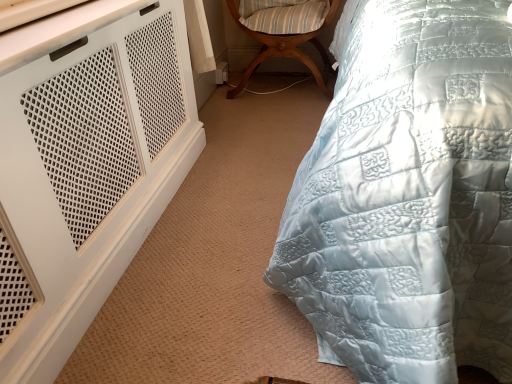
This screenshot has height=384, width=512. Describe the element at coordinates (284, 34) in the screenshot. I see `wooden striped cushioned chair at center` at that location.

In order to face wooden striped cushioned chair at center, should I rotate leftwards or rightwards?

You should look right and rotate roughly 4.130 degrees.

Locate an element on the screen. wooden striped cushioned chair at center is located at coordinates (284, 34).

The width and height of the screenshot is (512, 384). What do you see at coordinates (409, 198) in the screenshot? I see `light blue quilted fabric at center` at bounding box center [409, 198].

Where is `light blue quilted fabric at center`? The image size is (512, 384). light blue quilted fabric at center is located at coordinates (409, 198).

Consider the image. Measure the distance between light blue quilted fabric at center and camera.

The distance of light blue quilted fabric at center from camera is 24.33 inches.

The width and height of the screenshot is (512, 384). What are the coordinates of `wooden striped cushioned chair at center` in the screenshot? It's located at (284, 34).

Can you confirm if light blue quilted fabric at center is positioned to the left of wooden striped cushioned chair at center?

No, light blue quilted fabric at center is not to the left of wooden striped cushioned chair at center.

Is light blue quilted fabric at center in front of or behind wooden striped cushioned chair at center in the image?

In the image, light blue quilted fabric at center appears in front of wooden striped cushioned chair at center.

Does point (405, 285) lie in front of point (318, 78)?

Yes, it is in front of point (318, 78).

From the image's perspective, is light blue quilted fabric at center under wooden striped cushioned chair at center?

Yes, from the image's perspective, light blue quilted fabric at center is below wooden striped cushioned chair at center.

From a real-world perspective, who is located higher, light blue quilted fabric at center or wooden striped cushioned chair at center?

light blue quilted fabric at center, from a real-world perspective.

Looking at their sizes, would you say light blue quilted fabric at center is wider or thinner than wooden striped cushioned chair at center?

Considering their sizes, light blue quilted fabric at center looks broader than wooden striped cushioned chair at center.

Between light blue quilted fabric at center and wooden striped cushioned chair at center, which one has less height?

With less height is wooden striped cushioned chair at center.

Which of these two, light blue quilted fabric at center or wooden striped cushioned chair at center, is smaller?

Smaller between the two is wooden striped cushioned chair at center.

Could wooden striped cushioned chair at center be considered to be inside light blue quilted fabric at center?

No, wooden striped cushioned chair at center is not a part of light blue quilted fabric at center.

Would you say light blue quilted fabric at center is a long distance from wooden striped cushioned chair at center?

light blue quilted fabric at center is far away from wooden striped cushioned chair at center.

Does light blue quilted fabric at center turn towards wooden striped cushioned chair at center?

No, light blue quilted fabric at center is not aimed at wooden striped cushioned chair at center.

Can you tell me how much light blue quilted fabric at center and wooden striped cushioned chair at center differ in facing direction?

There is a 3.42e-06-degree angle between the facing directions of light blue quilted fabric at center and wooden striped cushioned chair at center.

Identify the location of chair above the light blue quilted fabric at center (from the image's perspective). (284, 34).

In the image, is wooden striped cushioned chair at center on the left side or the right side of light blue quilted fabric at center?

From the image, it's evident that wooden striped cushioned chair at center is to the left of light blue quilted fabric at center.

Between wooden striped cushioned chair at center and light blue quilted fabric at center, which one is positioned behind?

Positioned behind is wooden striped cushioned chair at center.

Is point (292, 34) farther from viewer compared to point (347, 230)?

Yes, point (292, 34) is behind point (347, 230).

From the image's perspective, which one is positioned lower, wooden striped cushioned chair at center or light blue quilted fabric at center?

light blue quilted fabric at center.

From a real-world perspective, is wooden striped cushioned chair at center physically below light blue quilted fabric at center?

Yes, from a real-world perspective, wooden striped cushioned chair at center is below light blue quilted fabric at center.

Is wooden striped cushioned chair at center wider or thinner than light blue quilted fabric at center?

wooden striped cushioned chair at center is thinner than light blue quilted fabric at center.

Considering the sizes of objects wooden striped cushioned chair at center and light blue quilted fabric at center in the image provided, who is taller, wooden striped cushioned chair at center or light blue quilted fabric at center?

light blue quilted fabric at center is taller.

Can you confirm if wooden striped cushioned chair at center is bigger than light blue quilted fabric at center?

No.

Would you say wooden striped cushioned chair at center is inside or outside light blue quilted fabric at center?

wooden striped cushioned chair at center lies outside light blue quilted fabric at center.

Is wooden striped cushioned chair at center far from light blue quilted fabric at center?

wooden striped cushioned chair at center is far away from light blue quilted fabric at center.

Could you tell me if wooden striped cushioned chair at center is turned towards light blue quilted fabric at center?

No, wooden striped cushioned chair at center is not facing towards light blue quilted fabric at center.

Measure the distance between wooden striped cushioned chair at center and light blue quilted fabric at center.

A distance of 1.42 meters exists between wooden striped cushioned chair at center and light blue quilted fabric at center.

Locate an element on the screen. The image size is (512, 384). chair beneath the light blue quilted fabric at center (from a real-world perspective) is located at coordinates (284, 34).

Where is `bed in front of the wooden striped cushioned chair at center`? The width and height of the screenshot is (512, 384). bed in front of the wooden striped cushioned chair at center is located at coordinates (409, 198).

Locate an element on the screen. bed that is above the wooden striped cushioned chair at center (from a real-world perspective) is located at coordinates (409, 198).